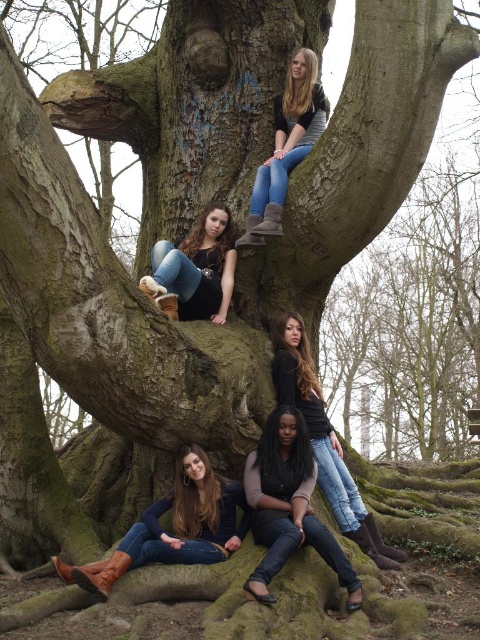
Who is lower down, brown leather boots at lower center or denim jeans at upper center?

brown leather boots at lower center is below.

The image size is (480, 640). What do you see at coordinates (173, 525) in the screenshot?
I see `brown leather boots at lower center` at bounding box center [173, 525].

Find the location of a particular element. brown leather boots at lower center is located at coordinates (173, 525).

Which is more to the left, brown leather boots at lower center or dark brown leather boots at lower center?

brown leather boots at lower center

Is point (188, 486) behind point (247, 472)?

No, (188, 486) is closer to viewer.

Image resolution: width=480 pixels, height=640 pixels. What do you see at coordinates (173, 525) in the screenshot? I see `brown leather boots at lower center` at bounding box center [173, 525].

Locate an element on the screen. The image size is (480, 640). brown leather boots at lower center is located at coordinates (173, 525).

In the scene shown: Does dark brown leather boots at lower center have a greater width compared to matte black boots at center?

Yes.

Image resolution: width=480 pixels, height=640 pixels. What are the coordinates of `dark brown leather boots at lower center` in the screenshot? It's located at (288, 506).